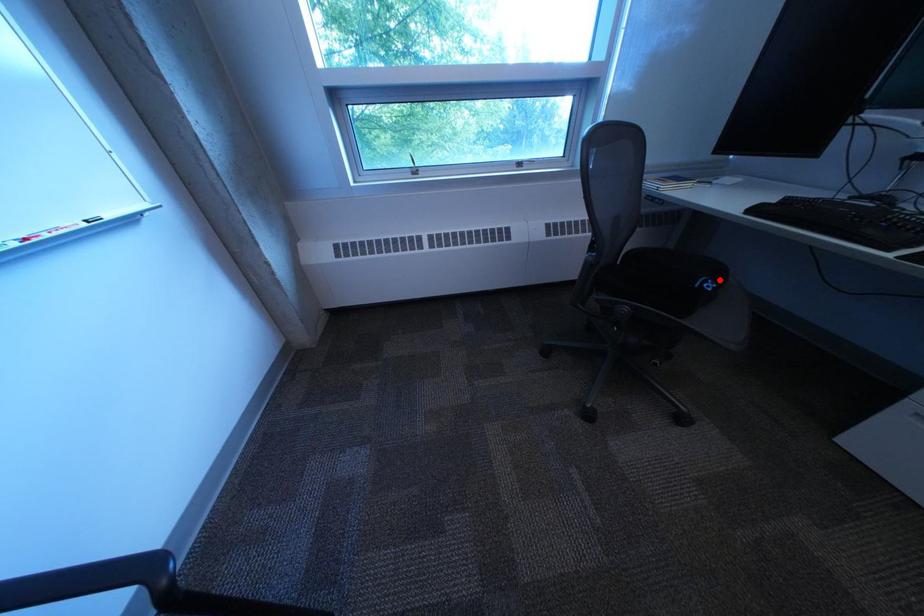
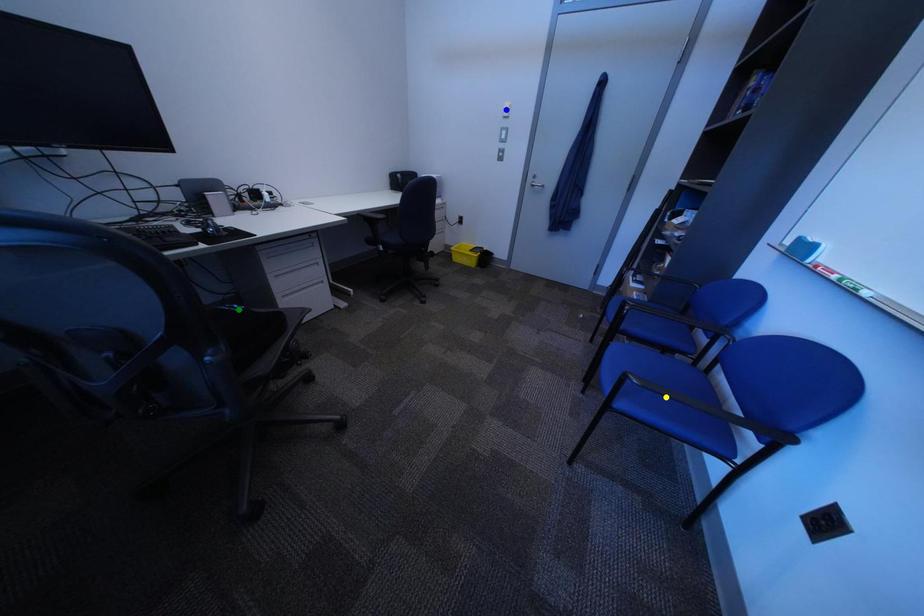
Question: I am providing you with two images of the same scene from different viewpoints. A red point is marked on the first image. You are given multiple points on the second image. Which mark in image 2 goes with the point in image 1?

Choices:
 (A) yellow point
 (B) blue point
 (C) green point

Answer: (C)